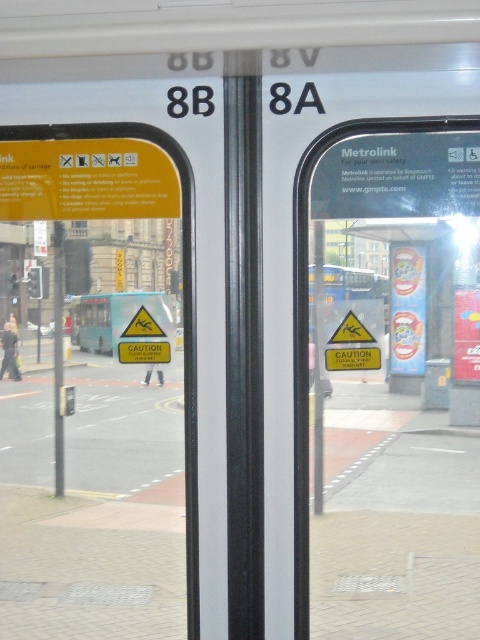
You are a tram passenger who wants to read the rules clearly. Which of the two yellow caution signs, the yellow caution sign at center or the yellow caution sign at left, is easier to read?

The yellow caution sign at center is bigger than the yellow caution sign at left, so it is easier to read.

You are a passenger standing at the tram door and want to take a photo of both point (294, 524) and point (193, 196). Which point will appear larger in your photo?

Point (294, 524) is closer to the camera than point (193, 196), so it will appear larger in the photo.